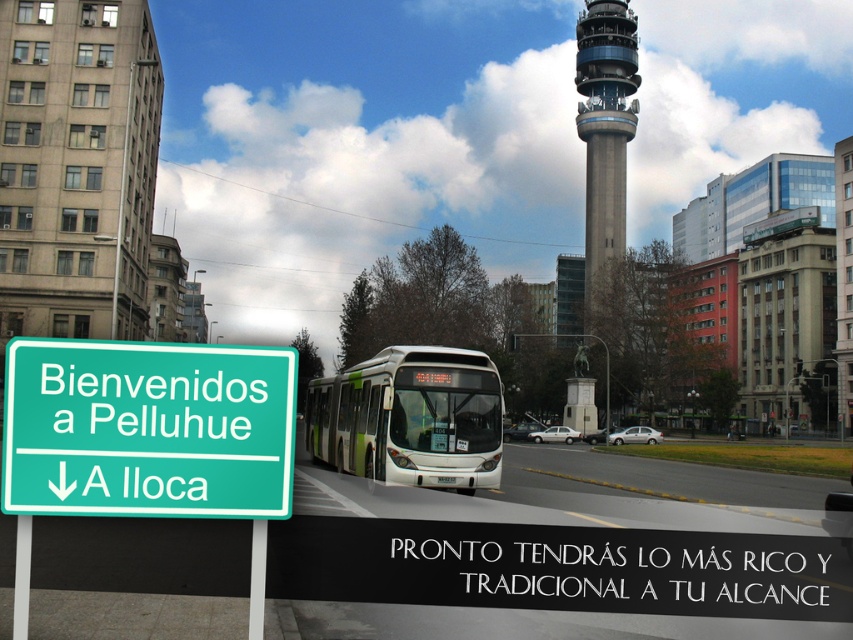
Can you confirm if green plastic sign at lower left is positioned to the right of concrete tower at upper center?

In fact, green plastic sign at lower left is to the left of concrete tower at upper center.

Between green plastic sign at lower left and concrete tower at upper center, which one appears on the left side from the viewer's perspective?

From the viewer's perspective, green plastic sign at lower left appears more on the left side.

Is point (276, 378) positioned after point (611, 13)?

No, (276, 378) is in front of (611, 13).

Locate an element on the screen. The height and width of the screenshot is (640, 853). green plastic sign at lower left is located at coordinates (148, 429).

Can you confirm if green plastic sign at lower left is shorter than green matte bus at center?

Yes, green plastic sign at lower left is shorter than green matte bus at center.

Is green plastic sign at lower left wider than green matte bus at center?

No, green plastic sign at lower left is not wider than green matte bus at center.

Does point (131, 372) lie behind point (396, 356)?

No, it is in front of (396, 356).

Locate an element on the screen. This screenshot has height=640, width=853. green plastic sign at lower left is located at coordinates (148, 429).

Who is higher up, green matte bus at center or concrete tower at upper center?

Positioned higher is concrete tower at upper center.

Does point (393, 378) come behind point (585, 58)?

No, it is in front of (585, 58).

Find the location of `green matte bus at center`. green matte bus at center is located at coordinates (410, 419).